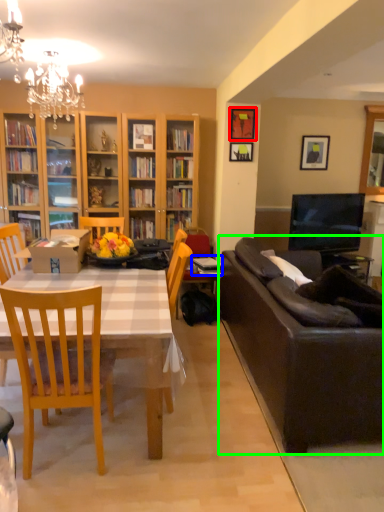
Question: Based on their relative distances, which object is nearer to picture frame (highlighted by a red box)? Choose from book (highlighted by a blue box) and studio couch (highlighted by a green box).

Choices:
 (A) book
 (B) studio couch

Answer: (A)